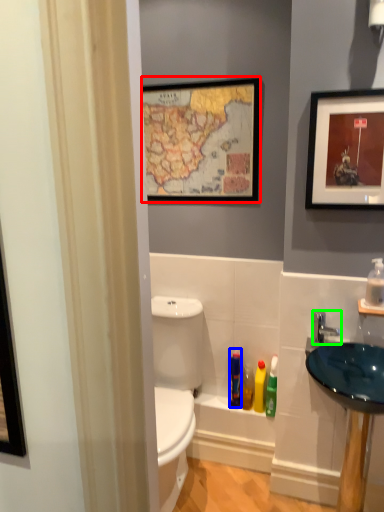
Question: Which object is the farthest from picture frame (highlighted by a red box)? Choose among these: toiletry (highlighted by a blue box) or tap (highlighted by a green box).

Choices:
 (A) toiletry
 (B) tap

Answer: (A)